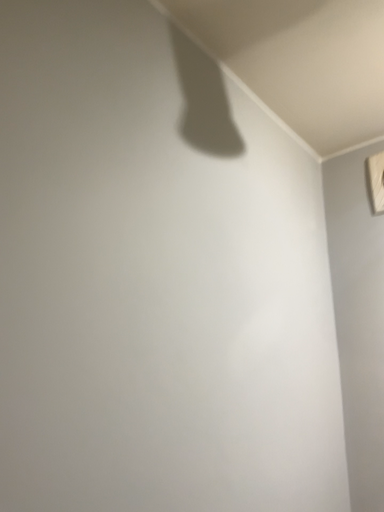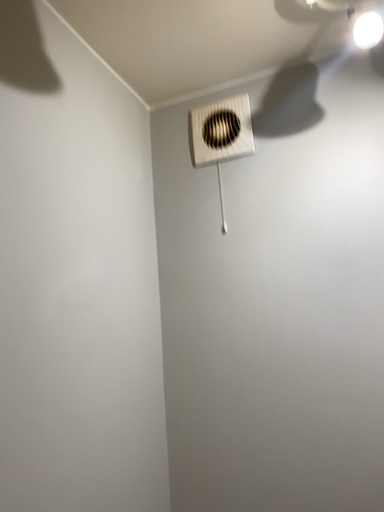
Question: Which way did the camera rotate in the video?

Choices:
 (A) rotated right
 (B) rotated left

Answer: (A)